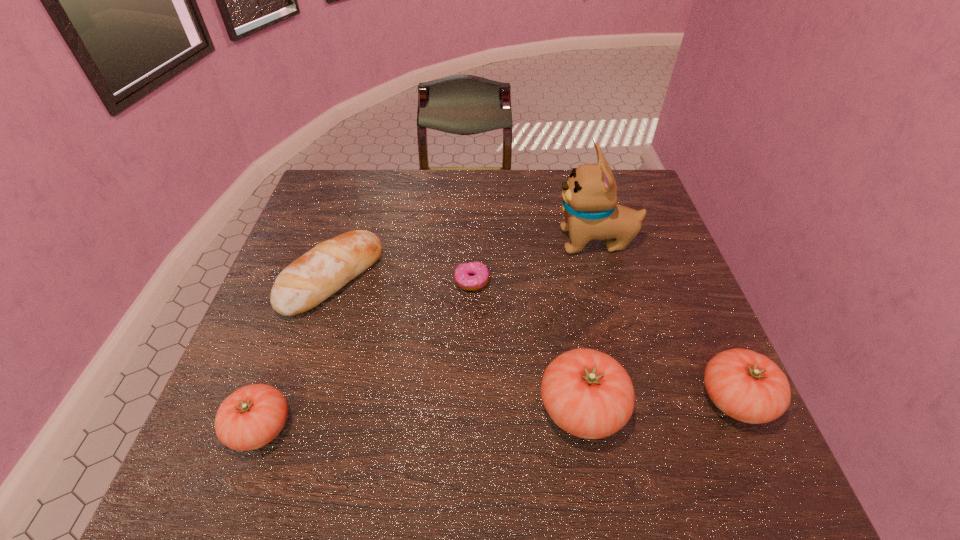
Please point a spot to place another tomato for symmetrical spacing. Please provide its 2D coordinates. Your answer should be formatted as a tuple, i.e. [(x, y)], where the tuple contains the x and y coordinates of a point satisfying the conditions above.

[(423, 417)]